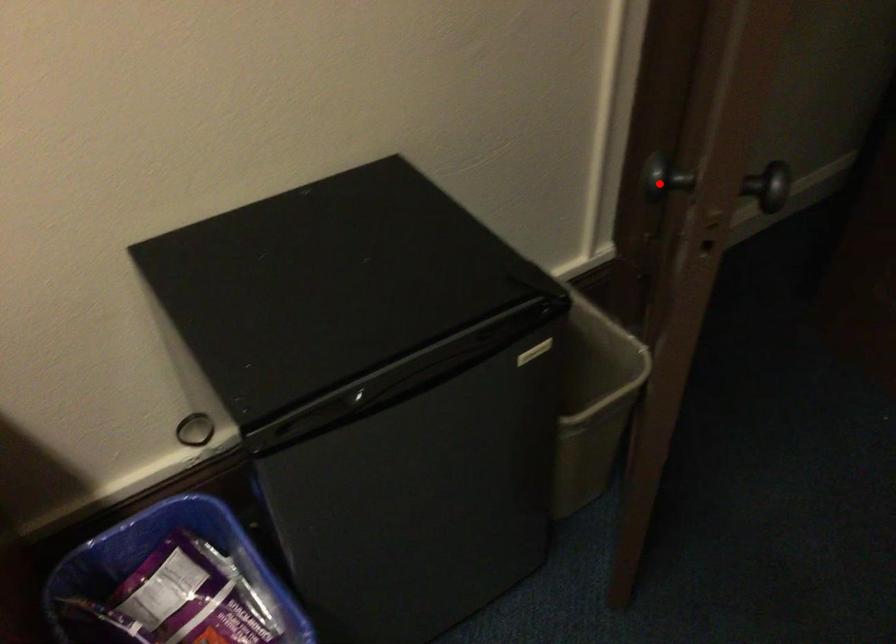
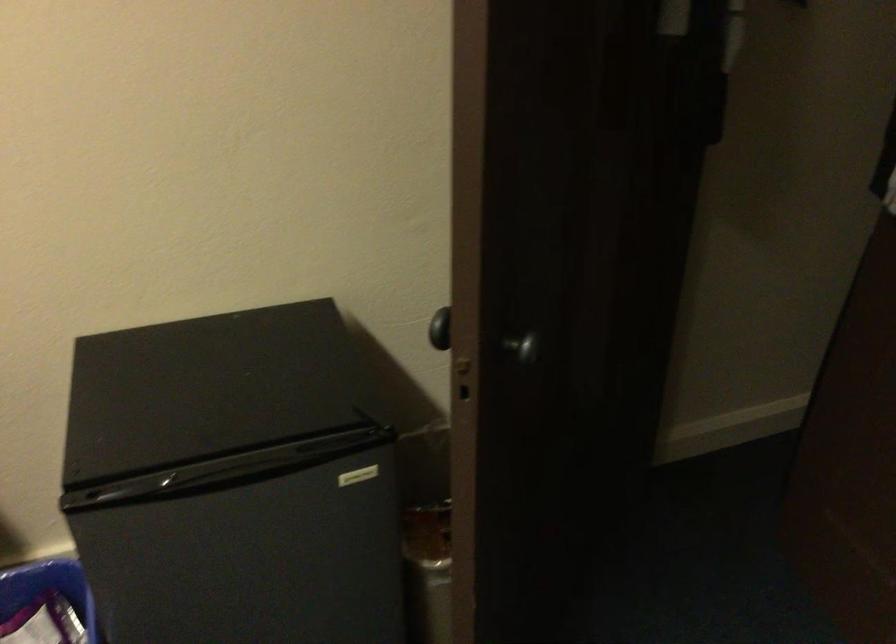
Where in the second image is the point corresponding to the highlighted location from the first image?

(440, 328)